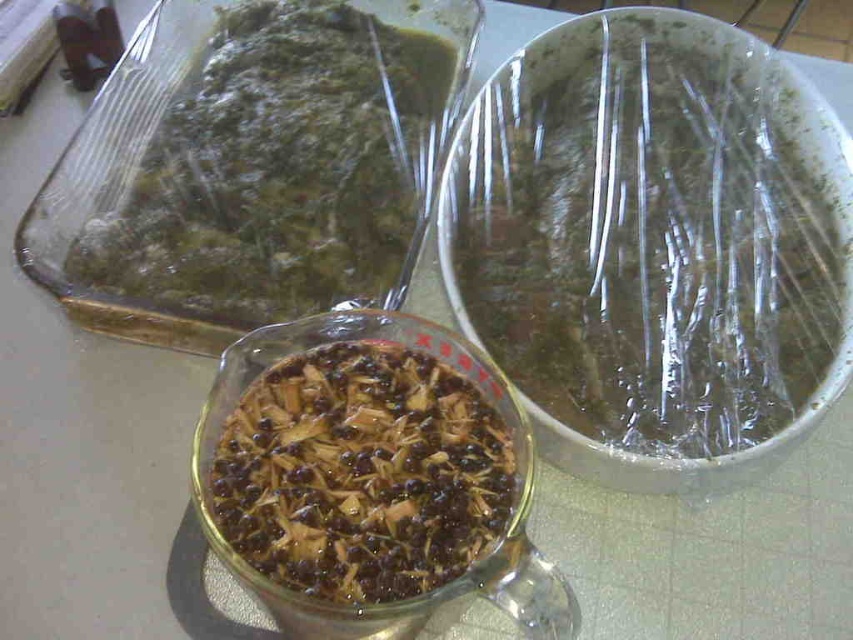
You are setting up a dinner table and need to place two bowls on the table. The transparent plastic bowl at upper right and the brown matte glass bowl at center must be placed exactly 7 inches apart. Can you position them correctly based on their current distance?

The transparent plastic bowl at upper right is currently 6.58 inches away from the brown matte glass bowl at center, which is slightly less than the required 7 inches. To meet the requirement, you need to move them about 0.42 inches farther apart.

You are arranging dishes on a table and need to place the transparent plastic bowl at upper right and the brown matte glass bowl at center. Which bowl should you place first to ensure proper visibility of both?

You should place the transparent plastic bowl at upper right first because it is closer to the viewer, allowing the brown matte glass bowl at center to be seen behind it.